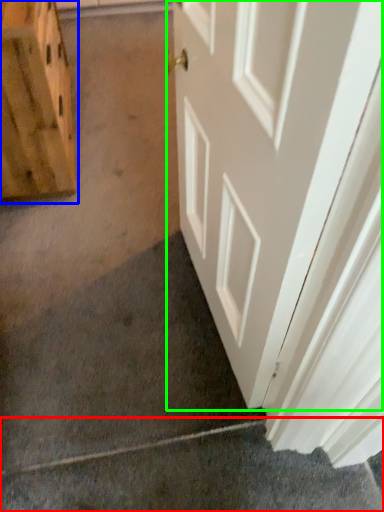
Question: Which object is positioned farthest from concrete (highlighted by a red box)? Select from cabinetry (highlighted by a blue box) and door (highlighted by a green box).

Choices:
 (A) cabinetry
 (B) door

Answer: (A)